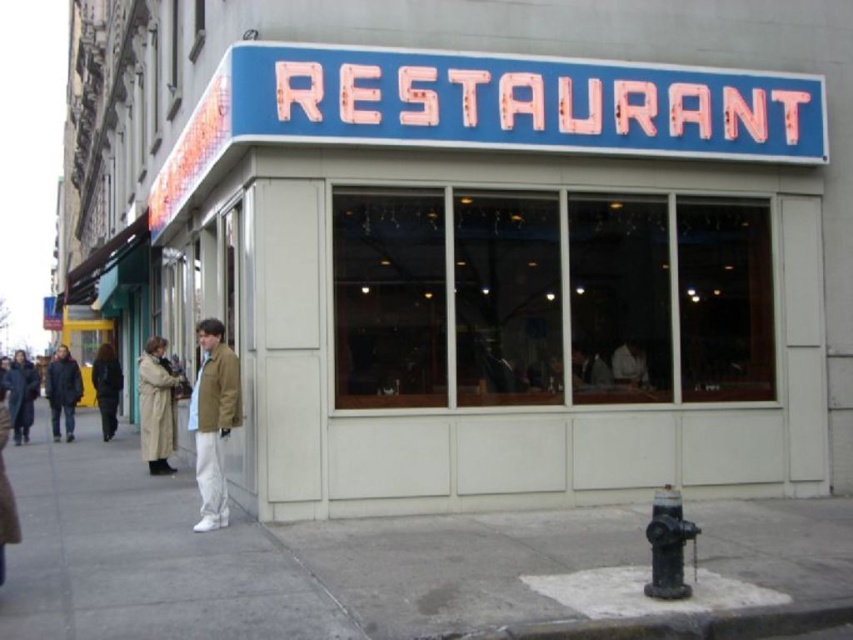
Question: Which object appears farthest from the camera in this image?

Choices:
 (A) tan leather jacket at center
 (B) blue neon sign at upper center

Answer: (B)

Question: Is gray concrete sidewalk at lower center above blue neon sign at upper center?

Choices:
 (A) yes
 (B) no

Answer: (B)

Question: Does black matte fire hydrant at lower right have a greater width compared to dark brown leather coat at lower left?

Choices:
 (A) no
 (B) yes

Answer: (A)

Question: Does dark blue jacket at lower left have a larger size compared to dark brown coat at left?

Choices:
 (A) no
 (B) yes

Answer: (B)

Question: Which point appears farthest from the camera in this image?

Choices:
 (A) (200, 490)
 (B) (109, 413)
 (C) (149, 374)
 (D) (57, 356)

Answer: (D)

Question: Which point appears farthest from the camera in this image?

Choices:
 (A) (810, 490)
 (B) (119, 378)
 (C) (18, 362)

Answer: (C)